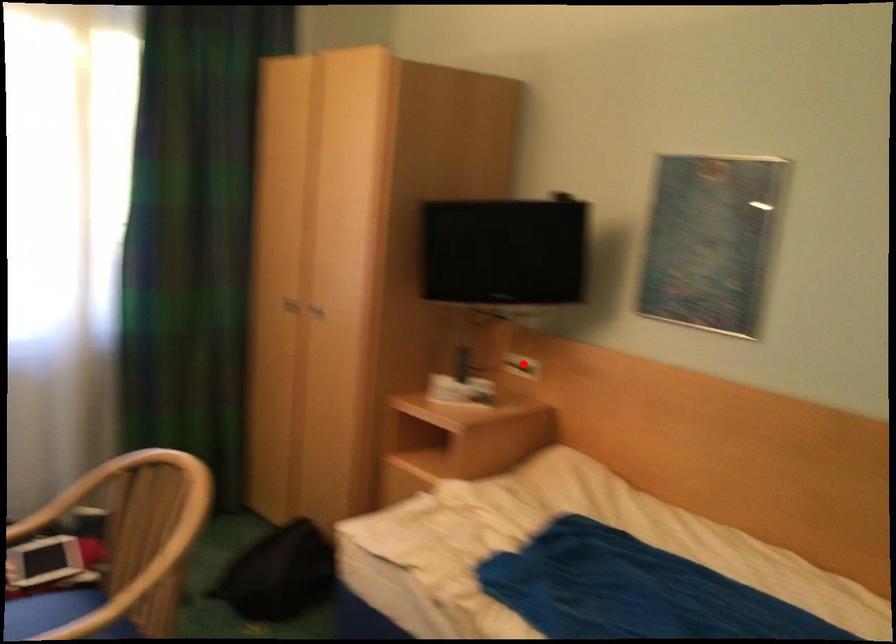
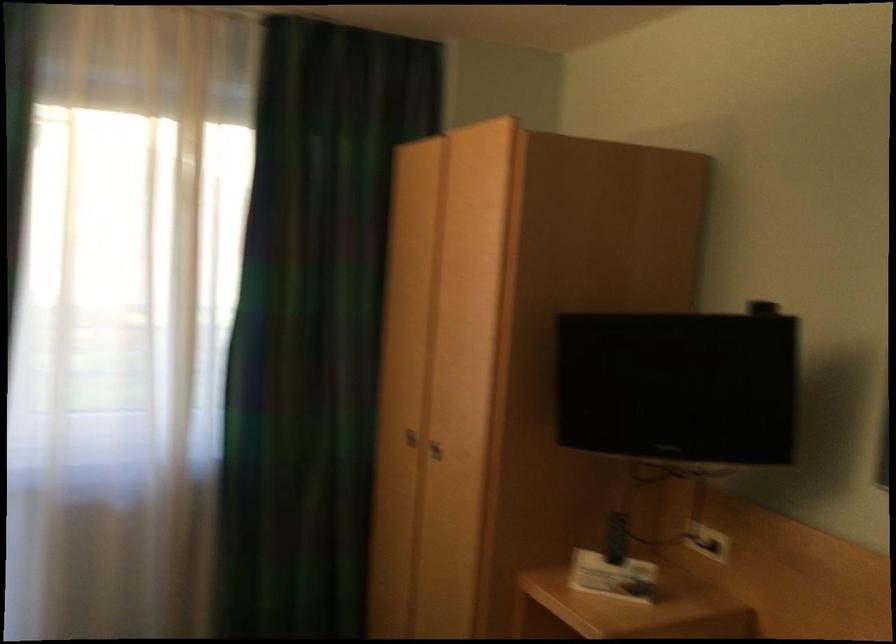
Question: A red point is marked in image1. In image2, is the corresponding 3D point closer to the camera or farther? Reply with the corresponding letter.

Choices:
 (A) The corresponding 3D point is closer.
 (B) The corresponding 3D point is farther.

Answer: (A)